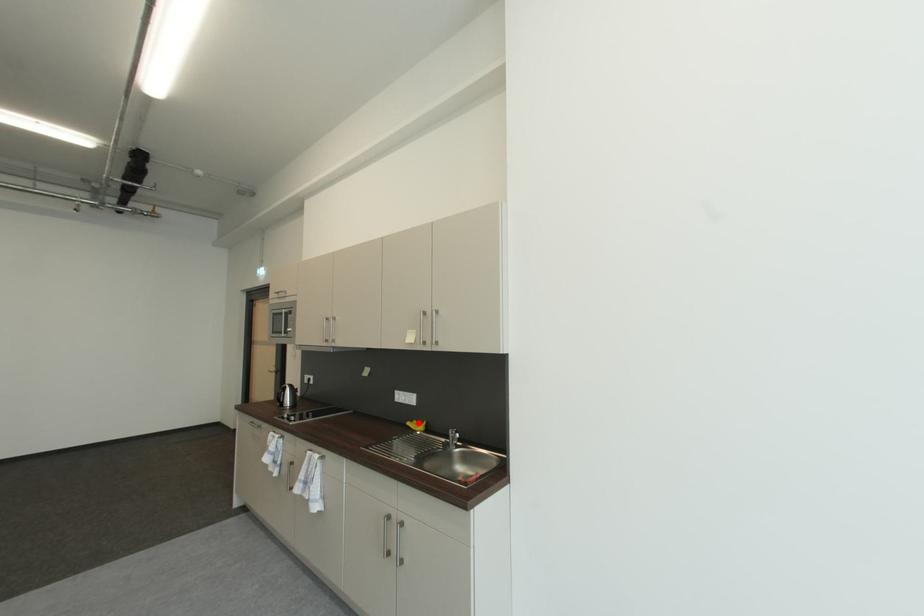
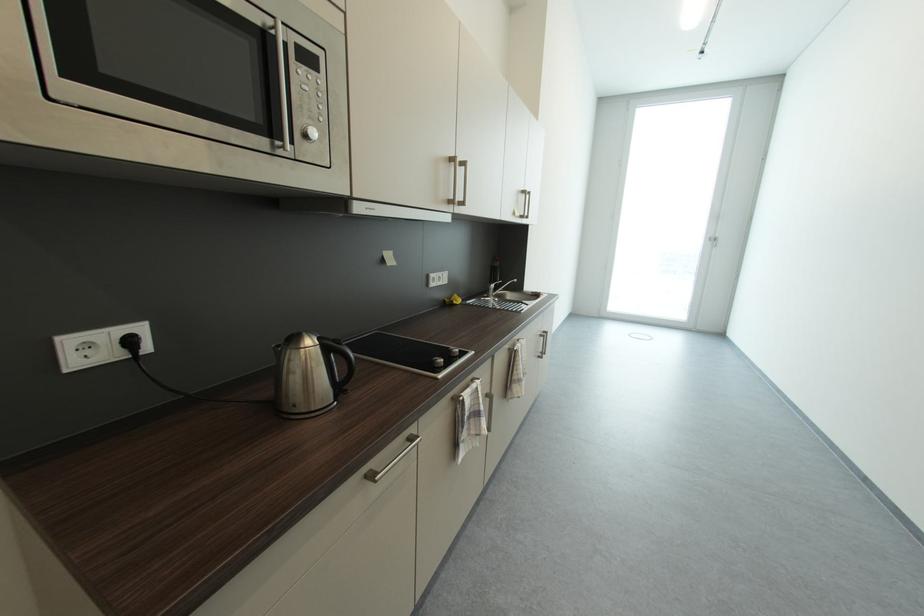
Question: I am providing you with two images of the same scene from different viewpoints. Given a red point in image1, look at the same physical point in image2. Is it:

Choices:
 (A) Closer to the viewpoint
 (B) Farther from the viewpoint

Answer: (A)